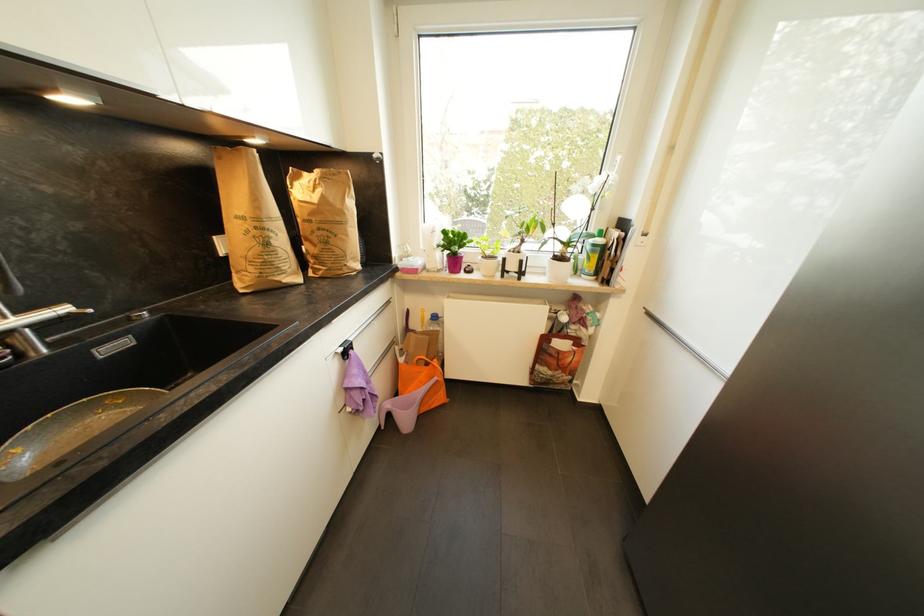
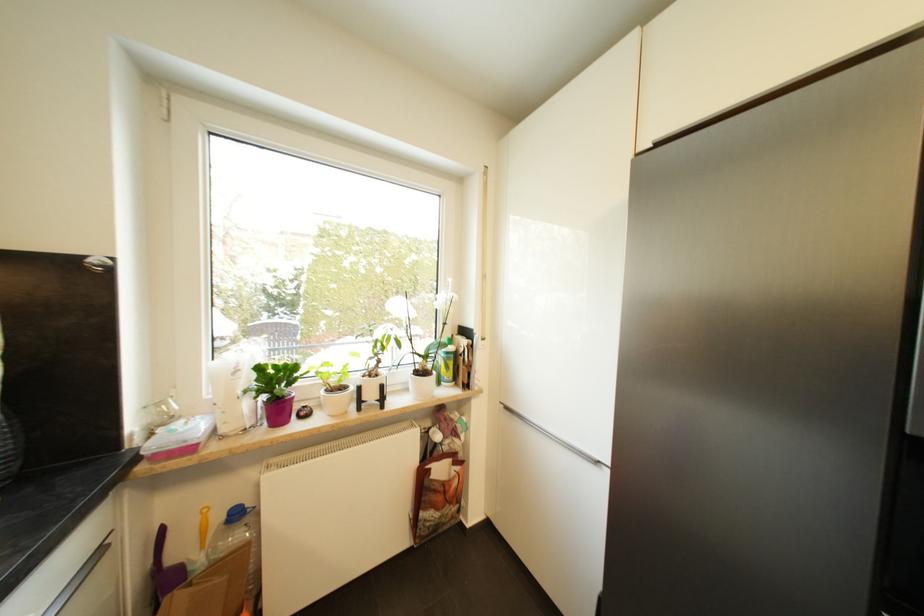
Locate, in the second image, the point that corresponds to (x=440, y=320) in the first image.

(241, 517)